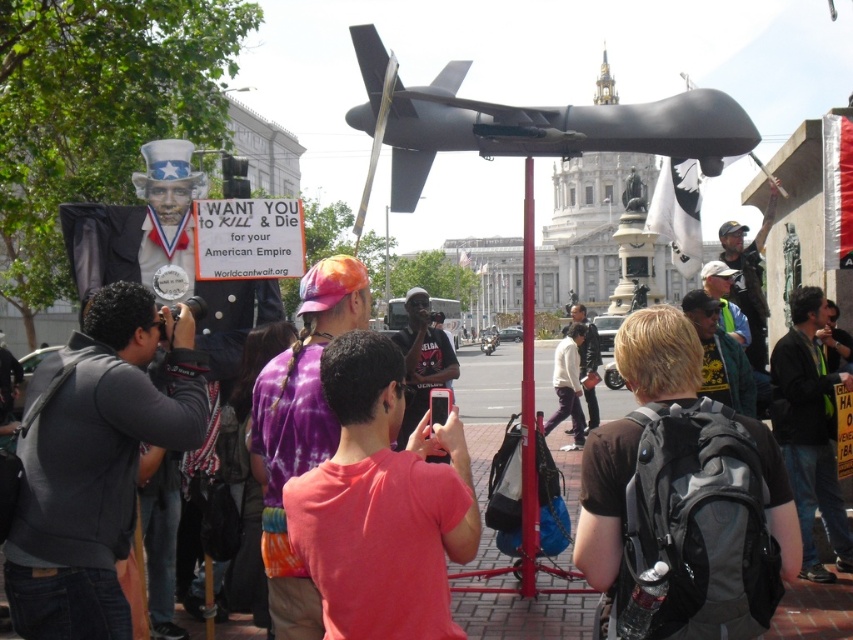
Is pink fabric shirt at center thinner than brown fuzzy wig at upper right?

In fact, pink fabric shirt at center might be wider than brown fuzzy wig at upper right.

Is the position of pink fabric shirt at center less distant than that of brown fuzzy wig at upper right?

Yes, it is in front of brown fuzzy wig at upper right.

Measure the distance between pink fabric shirt at center and camera.

pink fabric shirt at center is 299.69 feet from camera.

What are the coordinates of `pink fabric shirt at center` in the screenshot? It's located at (381, 504).

Can you confirm if purple tie-dye shirt at center is positioned above brown fuzzy wig at upper right?

No, purple tie-dye shirt at center is not above brown fuzzy wig at upper right.

Is purple tie-dye shirt at center closer to camera compared to brown fuzzy wig at upper right?

Yes.

Does point (366, 321) come farther from viewer compared to point (805, 301)?

No, it is not.

Where is `purple tie-dye shirt at center`? purple tie-dye shirt at center is located at coordinates (300, 432).

Who is more distant from viewer, (431, 321) or (718, 372)?

The point (431, 321) is more distant.

Who is higher up, dark gray t-shirt at center or yellow-green fabric at center?

dark gray t-shirt at center

Is point (404, 342) more distant than point (711, 392)?

Yes, it is.

Locate an element on the screen. dark gray t-shirt at center is located at coordinates (422, 358).